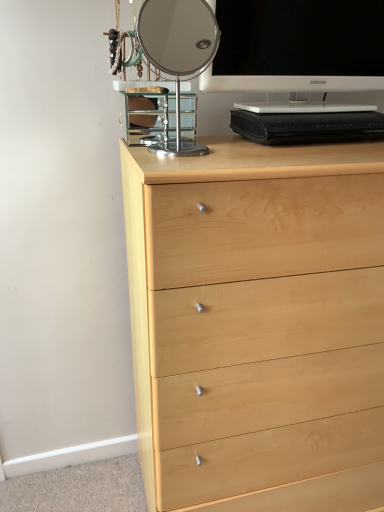
At what (x,y) coordinates should I click in order to perform the action: click on vacant area that lies to the right of polished chrome mirror at upper center. Please return your answer as a coordinate pair (x, y). The height and width of the screenshot is (512, 384). Looking at the image, I should click on (256, 155).